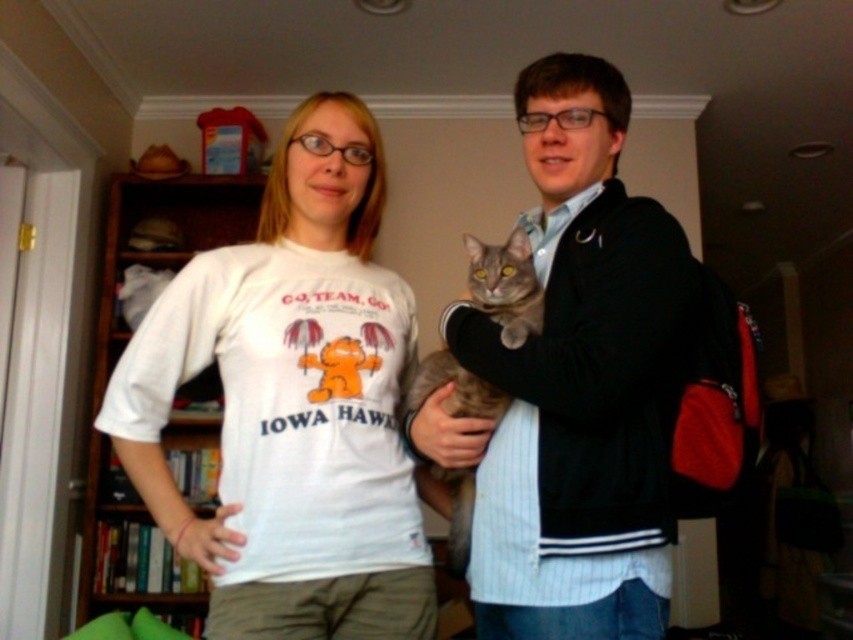
Can you confirm if gray fur cat at center is positioned to the right of wooden bookshelf at left?

Indeed, gray fur cat at center is positioned on the right side of wooden bookshelf at left.

The width and height of the screenshot is (853, 640). Find the location of `gray fur cat at center`. gray fur cat at center is located at coordinates (573, 385).

Locate an element on the screen. The height and width of the screenshot is (640, 853). gray fur cat at center is located at coordinates (573, 385).

Which is more to the left, wooden bookshelf at left or gray tabby cat at center?

From the viewer's perspective, wooden bookshelf at left appears more on the left side.

Where is `wooden bookshelf at left`? wooden bookshelf at left is located at coordinates (165, 250).

This screenshot has width=853, height=640. I want to click on wooden bookshelf at left, so click(x=165, y=250).

Can you confirm if white cotton t-shirt at center is taller than gray fur cat at center?

In fact, white cotton t-shirt at center may be shorter than gray fur cat at center.

Which is in front, point (322, 628) or point (438, 422)?

Point (322, 628) is in front.

Where is `white cotton t-shirt at center`? The width and height of the screenshot is (853, 640). white cotton t-shirt at center is located at coordinates (292, 403).